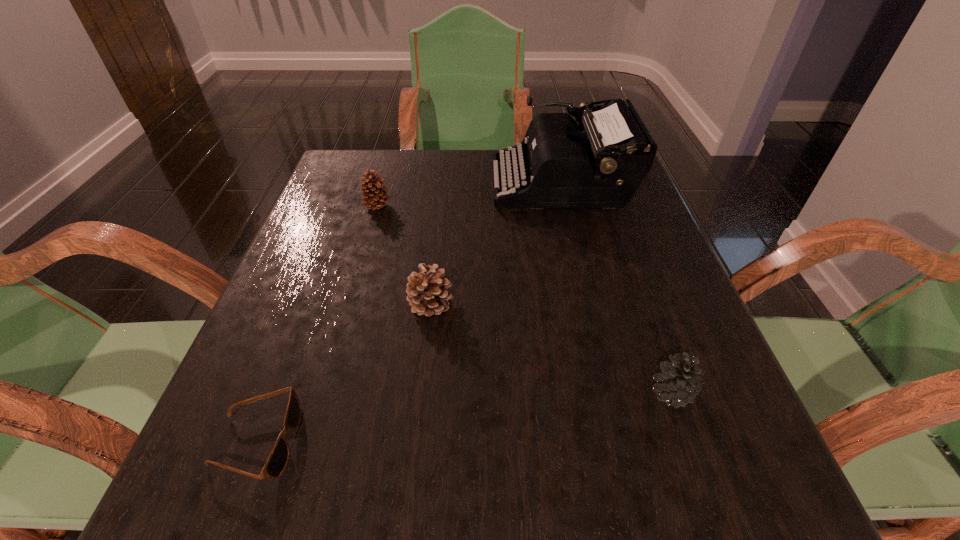
The height and width of the screenshot is (540, 960). Find the location of `vacant position located 0.320m on the right of the second nearest pinecone`. vacant position located 0.320m on the right of the second nearest pinecone is located at coordinates (633, 303).

Locate an element on the screen. The height and width of the screenshot is (540, 960). free space located 0.050m on the back of the rightmost pinecone is located at coordinates (656, 348).

Where is `free space located 0.130m on the frames of the shortest object`? free space located 0.130m on the frames of the shortest object is located at coordinates tap(389, 442).

Locate an element on the screen. typewriter present at the far edge is located at coordinates (564, 167).

The image size is (960, 540). What are the coordinates of `pinecone at the far edge` in the screenshot? It's located at (374, 199).

Where is `object at the near edge`? object at the near edge is located at coordinates (278, 458).

Locate an element on the screen. pinecone that is at the left edge is located at coordinates (374, 199).

Where is `sunglasses located in the left edge section of the desktop`? This screenshot has width=960, height=540. sunglasses located in the left edge section of the desktop is located at coordinates (278, 458).

Locate an element on the screen. The width and height of the screenshot is (960, 540). typewriter that is positioned at the right edge is located at coordinates (564, 167).

You are a GUI agent. You are given a task and a screenshot of the screen. Output one action in this format:
    pyautogui.click(x=<x>, y=<y>)
    Task: Click on the pinecone situated at the right edge
    This screenshot has height=540, width=960.
    Given the screenshot: What is the action you would take?
    pyautogui.click(x=679, y=383)